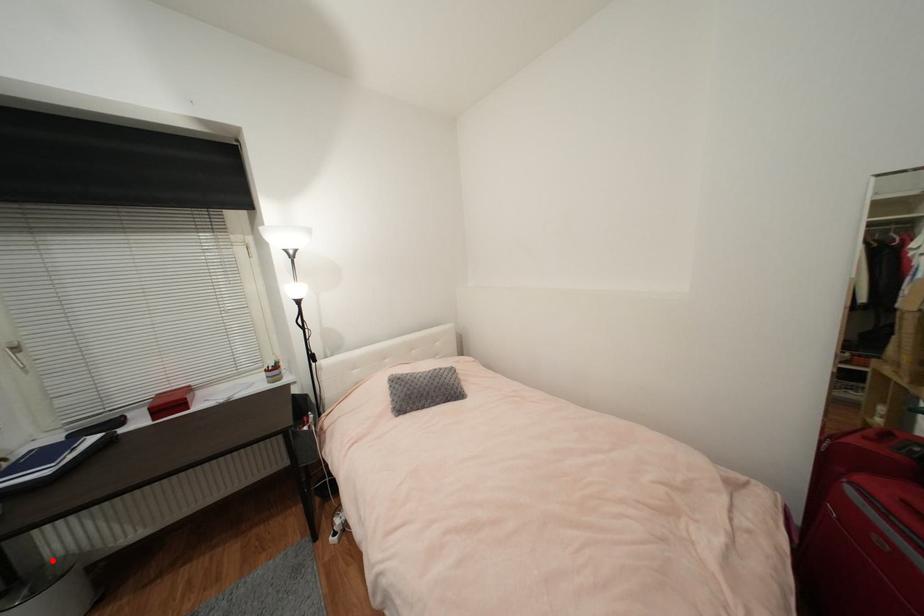
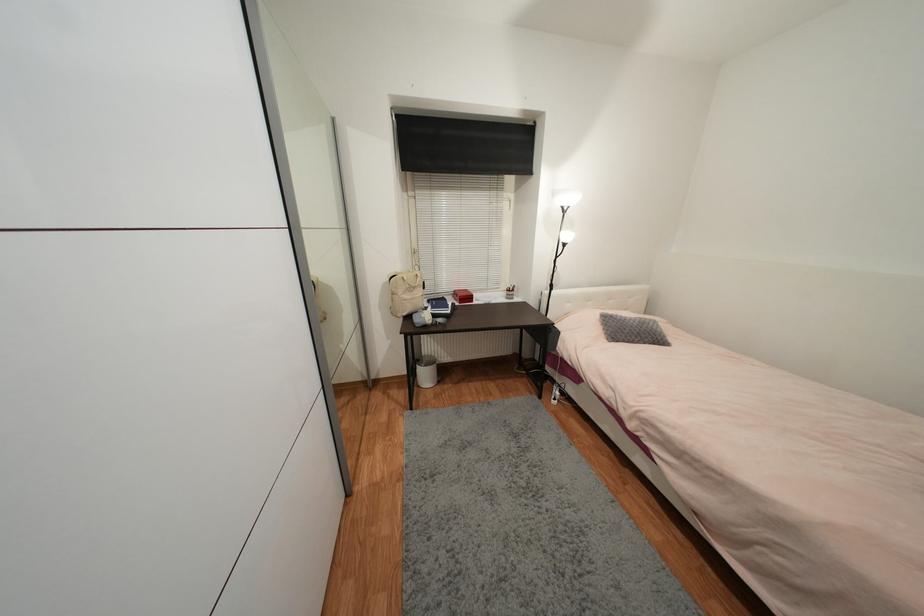
Find the pixel in the second image that matches the highlighted location in the first image.

(428, 355)